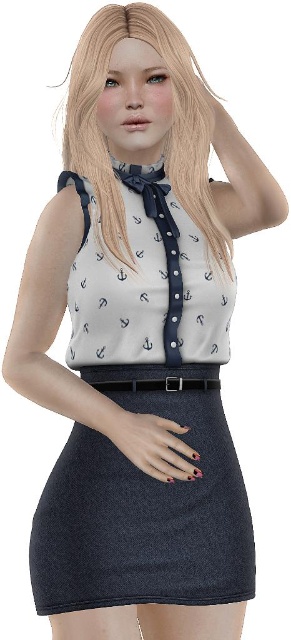
Question: Among these points, which one is farthest from the camera?

Choices:
 (A) (247, 506)
 (B) (135, 387)
 (C) (86, 120)

Answer: (A)

Question: Which is nearer to the denim skirt at lower center?

Choices:
 (A) black leather belt at center
 (B) navy blue satin bow tie at center
 (C) blondehair at upper center

Answer: (A)

Question: Estimate the real-world distances between objects in this image. Which object is farther from the denim skirt at lower center?

Choices:
 (A) navy blue satin bow tie at center
 (B) blondehair at upper center
 (C) black leather belt at center

Answer: (B)

Question: Is denim skirt at lower center wider than navy blue satin bow tie at center?

Choices:
 (A) yes
 (B) no

Answer: (A)

Question: Can you confirm if denim skirt at lower center is bigger than black leather belt at center?

Choices:
 (A) yes
 (B) no

Answer: (A)

Question: Is denim skirt at lower center below navy blue satin bow tie at center?

Choices:
 (A) yes
 (B) no

Answer: (A)